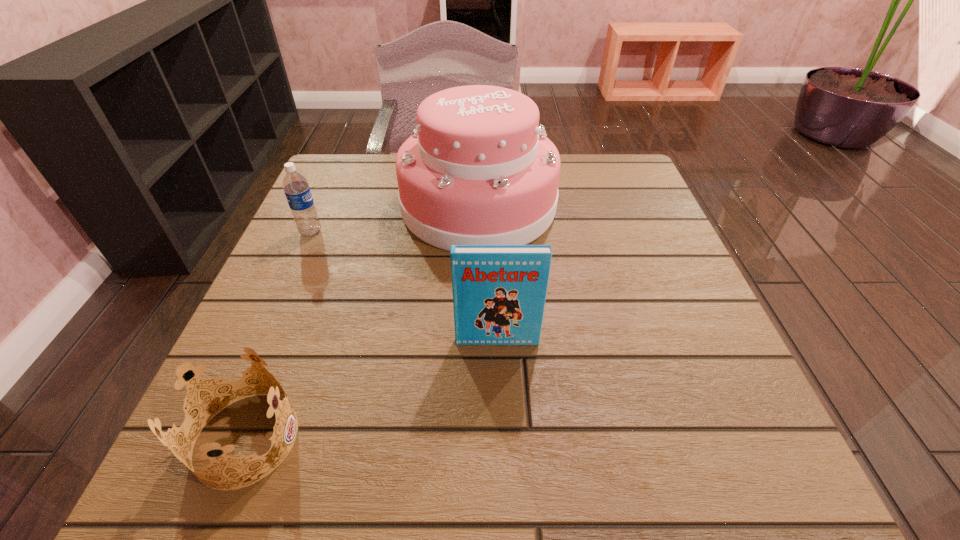
Identify which object is the closest to the third shortest object. Please provide its 2D coordinates. Your answer should be formatted as a tuple, i.e. [(x, y)], where the tuple contains the x and y coordinates of a point satisfying the conditions above.

[(478, 170)]

Identify which object is the second nearest to the book. Please provide its 2D coordinates. Your answer should be formatted as a tuple, i.e. [(x, y)], where the tuple contains the x and y coordinates of a point satisfying the conditions above.

[(184, 402)]